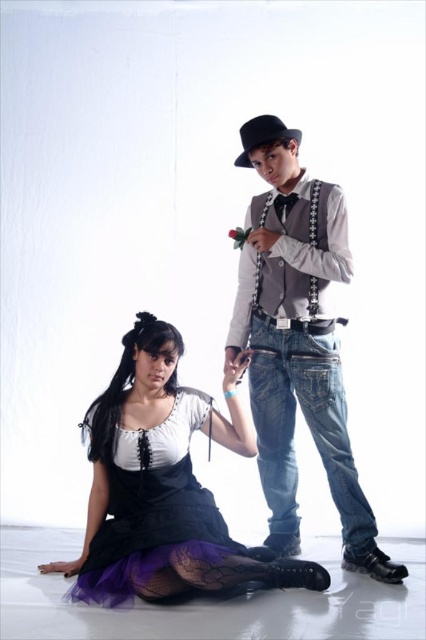
You are a photographer setting up a photoshoot. You need to position a spotlight so that it illuminates the matte black dress at lower left without affecting the gray matte vest at center. Based on their positions, is this possible?

Yes, since the matte black dress at lower left is in front of the gray matte vest at center, you can position the spotlight to shine directly on the dress while angling it away from the vest to avoid light spill.

You are a photographer setting up a shoot with two people. You notice the gray matte vest at center and the black felt cowboy hat at upper center in the scene. Which object is positioned to the right of the other?

The gray matte vest at center is to the right of the black felt cowboy hat at upper center.